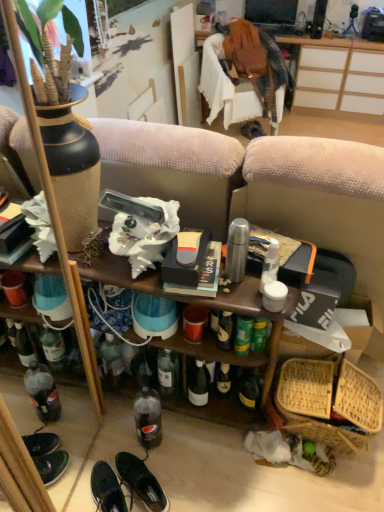
Question: Based on their positions, is clear plastic bottle at lower center located to the left or right of shiny black sneakers at lower left, the second footwear positioned from the right?

Choices:
 (A) right
 (B) left

Answer: (A)

Question: Does point (150, 410) appear closer or farther from the camera than point (109, 495)?

Choices:
 (A) farther
 (B) closer

Answer: (A)

Question: Which object is the closest to the wooden desk at upper center?

Choices:
 (A) bamboo woven basket at lower right
 (B) wooden shelf at center
 (C) black leather shoes at lower center, marked as the 1th footwear in a right-to-left arrangement
 (D) shiny black sneakers at lower left, the first footwear when ordered from left to right
 (E) clear plastic bottle at lower center

Answer: (B)

Question: Estimate the real-world distances between objects in this image. Which object is closer to the wooden desk at upper center?

Choices:
 (A) clear plastic bottle at lower center
 (B) wooden shelf at center
 (C) black leather shoes at lower center, which appears as the 2th footwear when viewed from the left
 (D) shiny black sneakers at lower left, the first footwear when ordered from left to right
 (E) bamboo woven basket at lower right

Answer: (B)